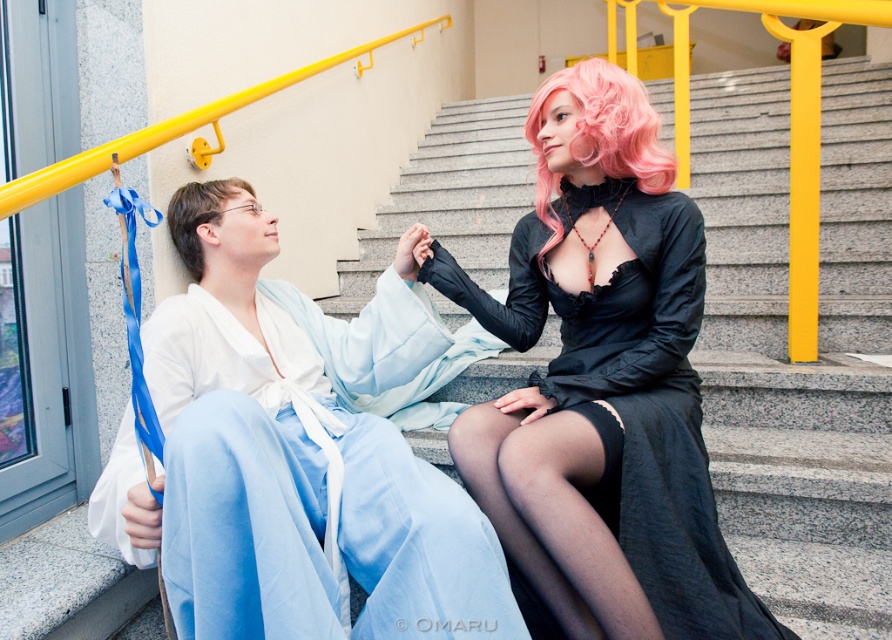
Question: Among these objects, which one is nearest to the camera?

Choices:
 (A) light brown silky hair at upper left
 (B) pink curly wig at upper right

Answer: (B)

Question: Which object is positioned farthest from the satin black dress at center?

Choices:
 (A) pink curly wig at upper right
 (B) light blue silk robe at lower left

Answer: (B)

Question: Is the position of satin black dress at center more distant than that of pink curly wig at upper right?

Choices:
 (A) no
 (B) yes

Answer: (A)

Question: Is light blue silk robe at lower left closer to the viewer compared to light brown silky hair at upper left?

Choices:
 (A) yes
 (B) no

Answer: (A)

Question: Among these points, which one is nearest to the camera?

Choices:
 (A) (604, 172)
 (B) (630, 465)
 (C) (398, 372)
 (D) (178, 250)

Answer: (B)

Question: Does satin black dress at center have a smaller size compared to light blue silk robe at lower left?

Choices:
 (A) yes
 (B) no

Answer: (A)